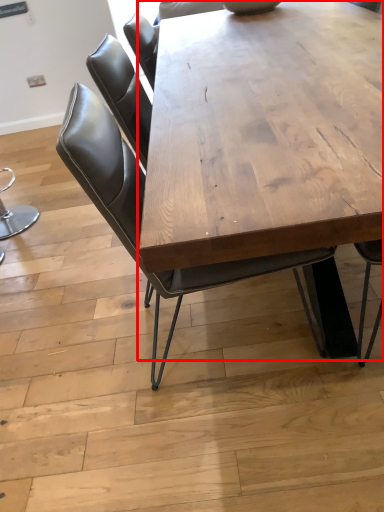
Question: From the image's perspective, what is the correct spatial relationship of coffee table (annotated by the red box) in relation to chair?

Choices:
 (A) below
 (B) above

Answer: (B)